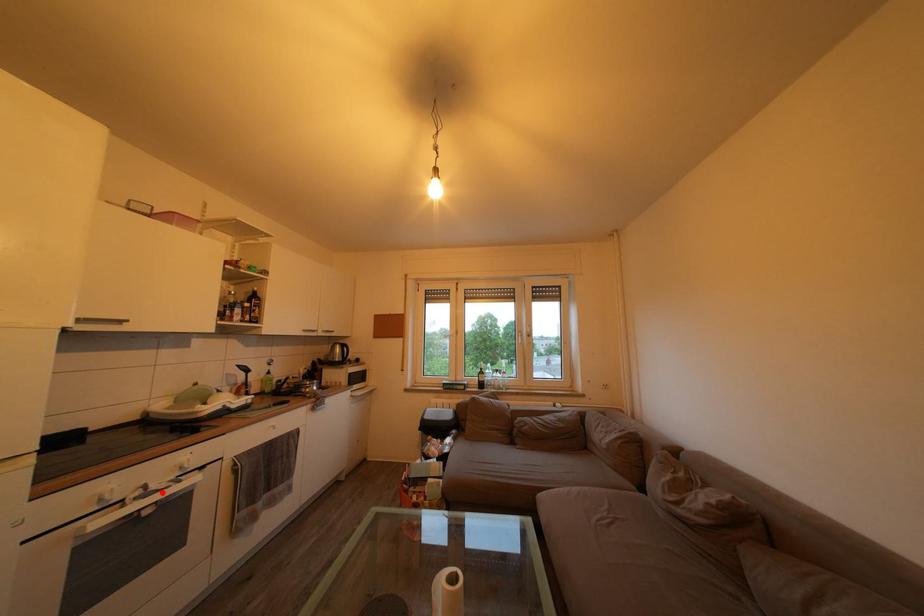
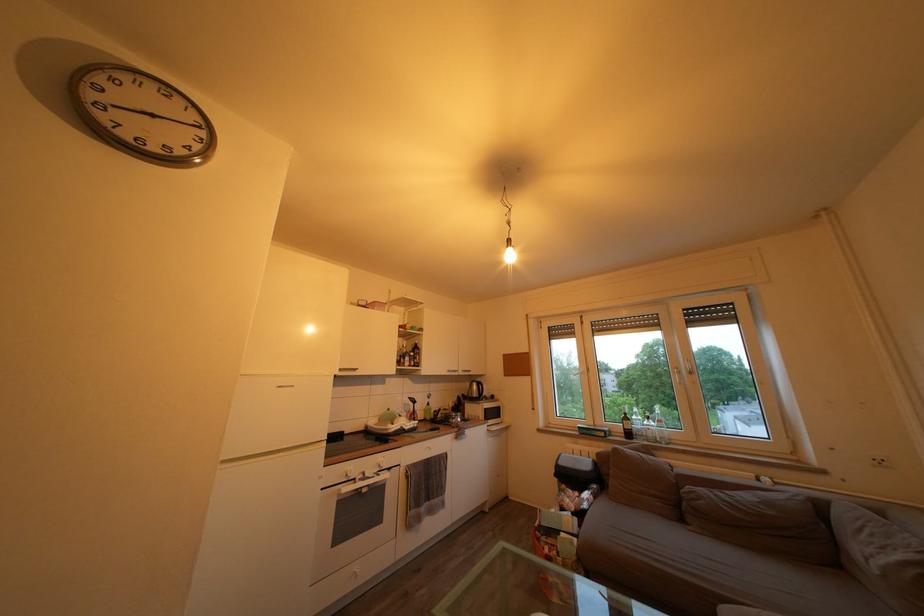
Question: I am providing you with two images of the same scene from different viewpoints. A red point is marked on the first image. At the location where the point appears in image 1, is it still visible in image 2?

Choices:
 (A) Yes
 (B) No

Answer: (A)